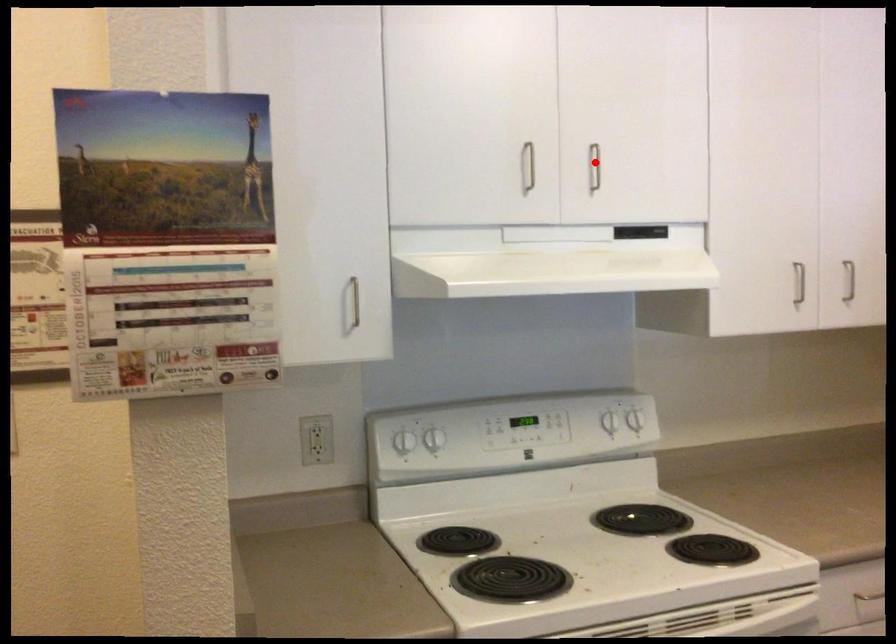
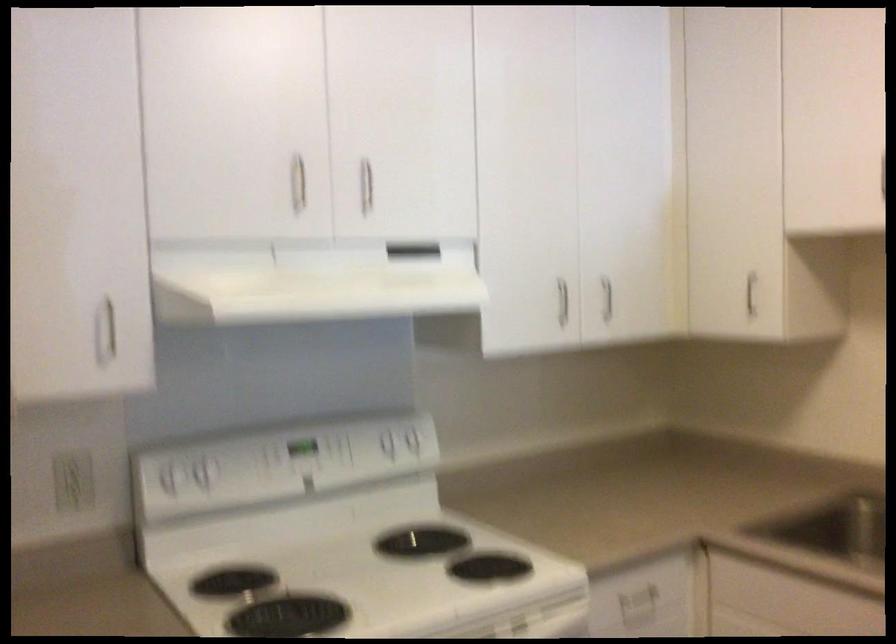
Question: I am providing you with two images of the same scene from different viewpoints. A red point is marked on the first image. At the location where the point appears in image 1, is it still visible in image 2?

Choices:
 (A) Yes
 (B) No

Answer: (A)